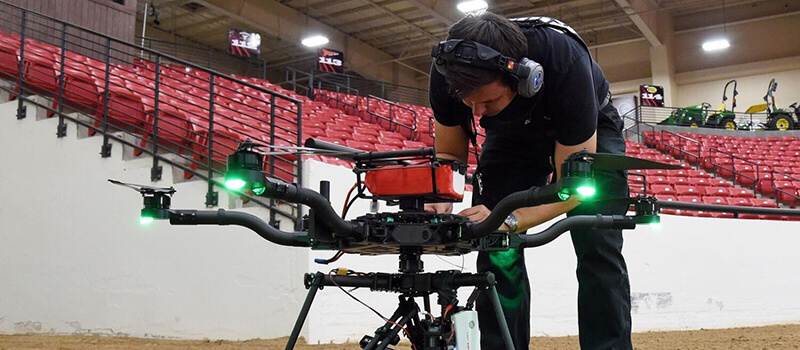
Where is `seats`? Image resolution: width=800 pixels, height=350 pixels. seats is located at coordinates (213, 105).